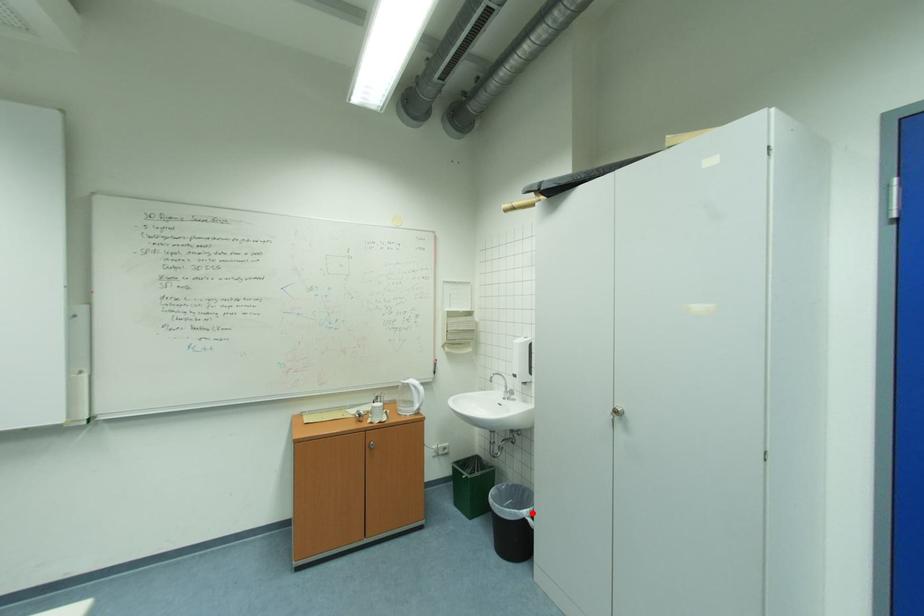
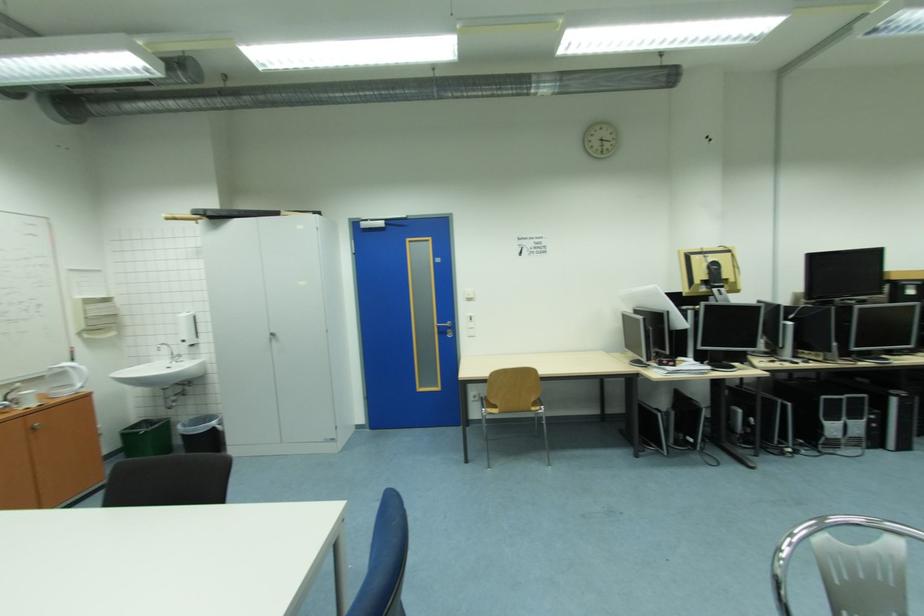
Question: I am providing you with two images of the same scene from different viewpoints. In image1, a red point is highlighted. Considering the same 3D point in image2, which of the following is correct?

Choices:
 (A) It is closer
 (B) It is farther

Answer: (A)